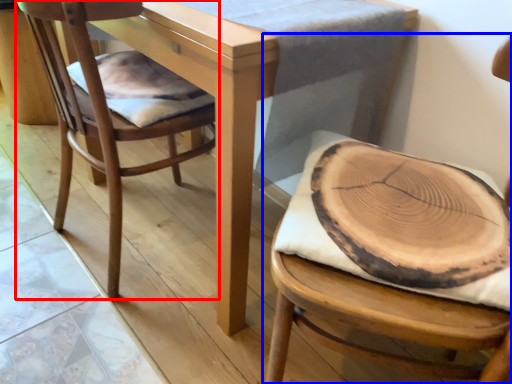
Question: Among these objects, which one is farthest to the camera, chair (highlighted by a red box) or chair (highlighted by a blue box)?

Choices:
 (A) chair
 (B) chair

Answer: (A)